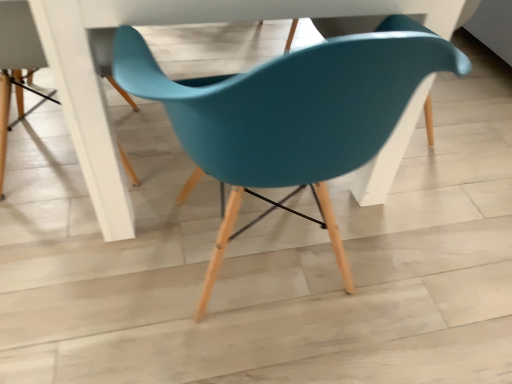
Find the location of `vacant area that is in front of teal plastic chair at upper center, which ranks as the 1th chair in left-to-right order`. vacant area that is in front of teal plastic chair at upper center, which ranks as the 1th chair in left-to-right order is located at coordinates (71, 279).